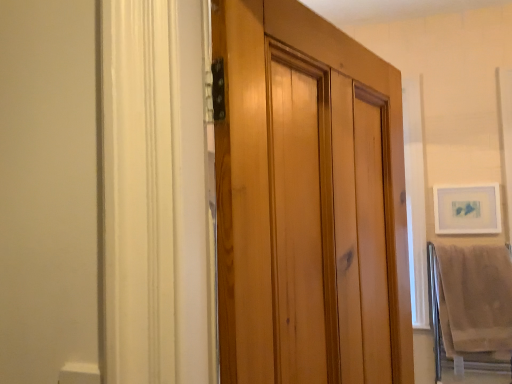
Question: In terms of size, does beige cotton bath towel at lower right appear bigger or smaller than matte white picture frame at upper right?

Choices:
 (A) big
 (B) small

Answer: (A)

Question: Looking at their shapes, would you say beige cotton bath towel at lower right is wider or thinner than matte white picture frame at upper right?

Choices:
 (A) thin
 (B) wide

Answer: (B)

Question: Does point (453, 291) appear closer or farther from the camera than point (463, 223)?

Choices:
 (A) closer
 (B) farther

Answer: (A)

Question: From a real-world perspective, is matte white picture frame at upper right above or below beige cotton bath towel at lower right?

Choices:
 (A) below
 (B) above

Answer: (B)

Question: Is matte white picture frame at upper right in front of or behind beige cotton bath towel at lower right in the image?

Choices:
 (A) behind
 (B) front

Answer: (A)

Question: Based on their positions, is matte white picture frame at upper right located to the left or right of beige cotton bath towel at lower right?

Choices:
 (A) right
 (B) left

Answer: (A)

Question: Considering the positions of matte white picture frame at upper right and beige cotton bath towel at lower right in the image, is matte white picture frame at upper right taller or shorter than beige cotton bath towel at lower right?

Choices:
 (A) short
 (B) tall

Answer: (A)